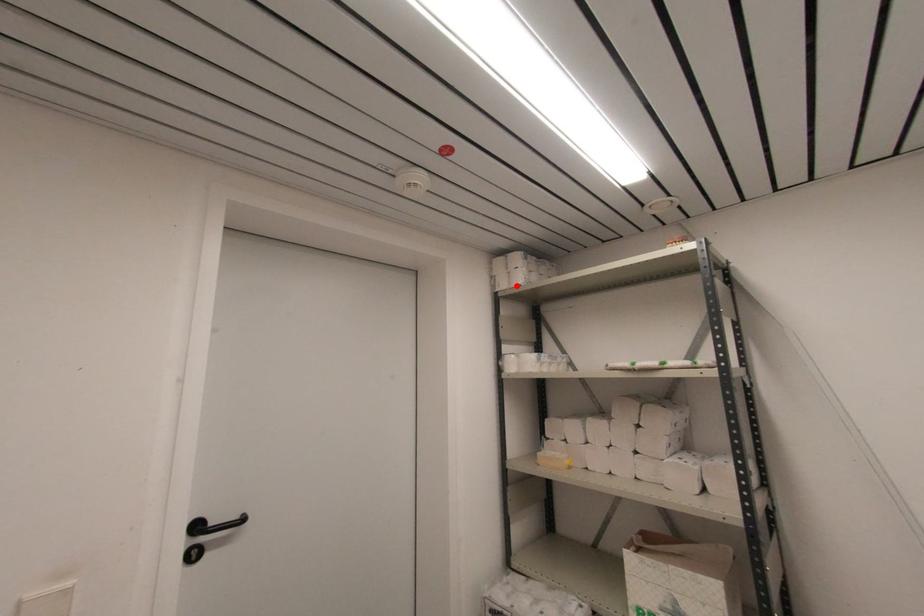
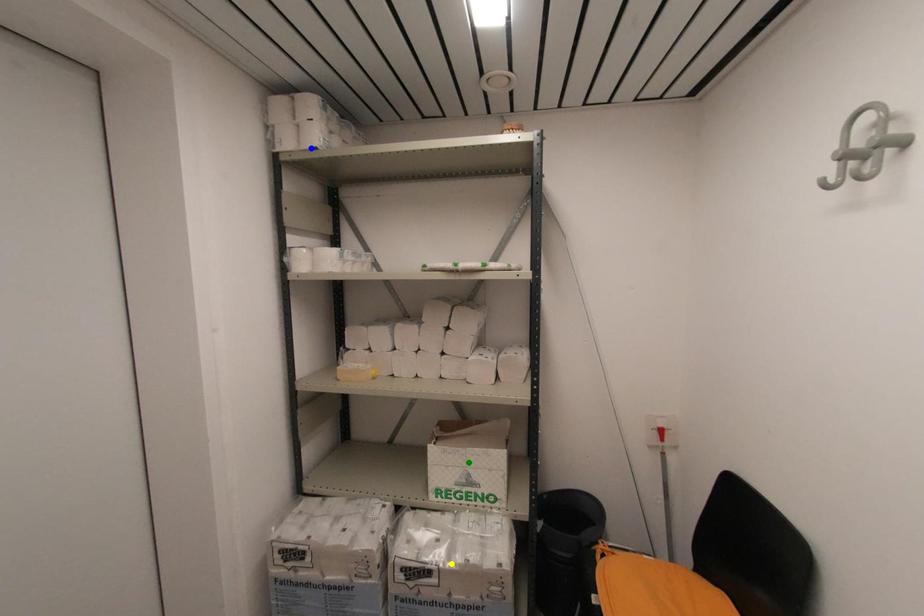
Question: I am providing you with two images of the same scene from different viewpoints. A red point is marked on the first image. You are given multiple points on the second image. Can you choose the point in image 2 that corresponds to the point in image 1?

Choices:
 (A) blue point
 (B) yellow point
 (C) green point

Answer: (A)